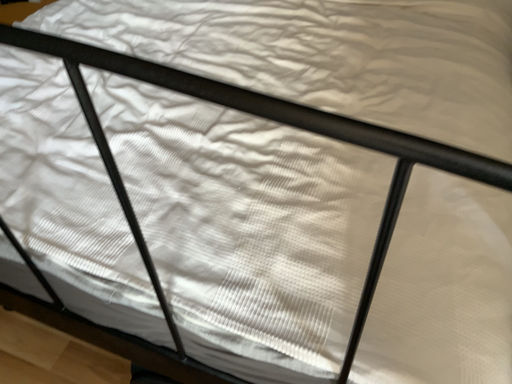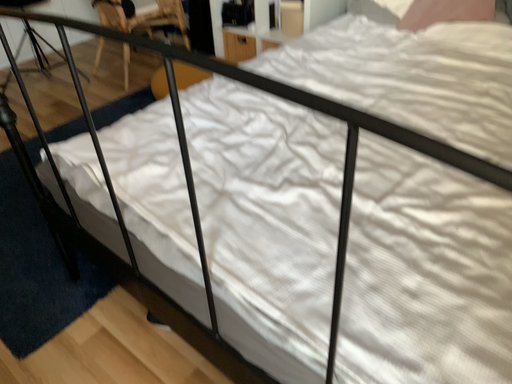
Question: Which way did the camera rotate in the video?

Choices:
 (A) rotated downward
 (B) rotated upward

Answer: (B)